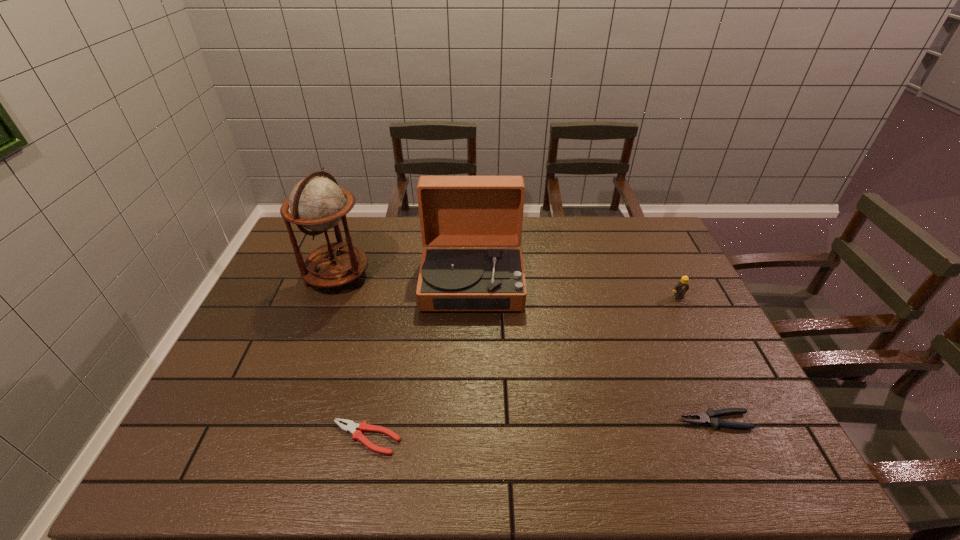
The height and width of the screenshot is (540, 960). What are the coordinates of `pliers present at the right edge` in the screenshot? It's located at (709, 417).

The width and height of the screenshot is (960, 540). I want to click on object present at the far left corner, so click(x=316, y=203).

This screenshot has height=540, width=960. What are the coordinates of `vacant space at the far edge of the desktop` in the screenshot? It's located at (413, 228).

Find the location of a particular element. The width and height of the screenshot is (960, 540). vacant space at the near edge of the desktop is located at coordinates (362, 464).

You are a GUI agent. You are given a task and a screenshot of the screen. Output one action in this format:
    pyautogui.click(x=<x>, y=<y>)
    Task: Click on the vacant area at the left edge of the desktop
    This screenshot has height=540, width=960.
    Given the screenshot: What is the action you would take?
    pyautogui.click(x=294, y=300)

Where is `free spot at the right edge of the desktop`? The image size is (960, 540). free spot at the right edge of the desktop is located at coordinates (671, 345).

Where is `vacant area at the far right corner`? Image resolution: width=960 pixels, height=540 pixels. vacant area at the far right corner is located at coordinates (653, 233).

The image size is (960, 540). What are the coordinates of `free space between the shortest object and the second tallest object` in the screenshot? It's located at pos(420,360).

Locate an element on the screen. This screenshot has height=540, width=960. vacant region between the third shortest object and the shorter pliers is located at coordinates (522, 367).

Find the location of `vacant space in between the taller pliers and the globe`. vacant space in between the taller pliers and the globe is located at coordinates (526, 348).